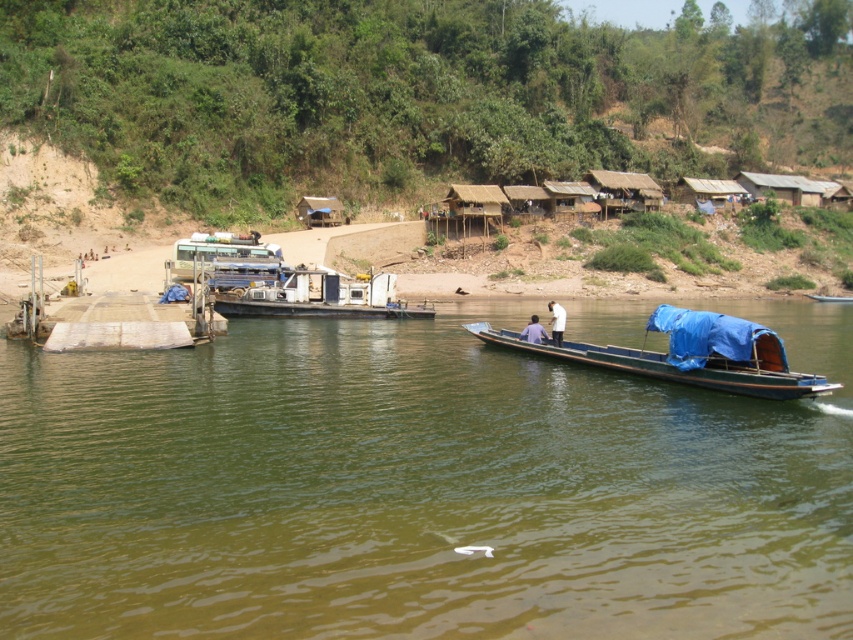
Question: Among these points, which one is farthest from the camera?

Choices:
 (A) [758, 364]
 (B) [358, 298]

Answer: (B)

Question: Which object appears farthest from the camera in this image?

Choices:
 (A) blue fabric boat at center
 (B) green matte water at center
 (C) green leafy hillside at upper center

Answer: (C)

Question: Is green matte water at center to the right of metallic gray boat at center from the viewer's perspective?

Choices:
 (A) yes
 (B) no

Answer: (A)

Question: Is metallic gray boat at center positioned behind blue fabric boat at center?

Choices:
 (A) yes
 (B) no

Answer: (A)

Question: Considering the real-world distances, which object is farthest from the metallic gray boat at center?

Choices:
 (A) blue fabric boat at center
 (B) blue fabric boat at lower right
 (C) green leafy hillside at upper center
 (D) wooden planks dock at left

Answer: (C)

Question: Is green leafy hillside at upper center wider than wooden planks dock at left?

Choices:
 (A) yes
 (B) no

Answer: (A)